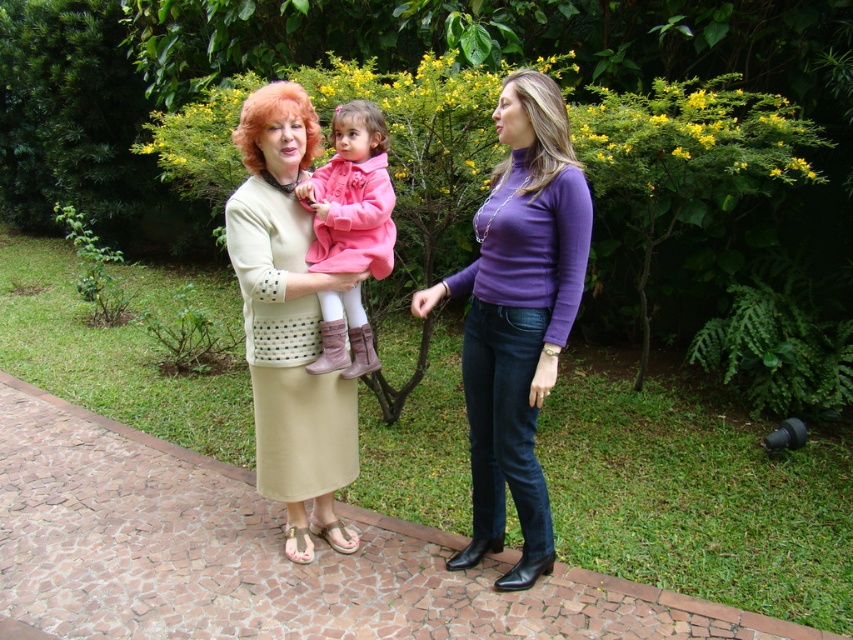
You are a photographer taking a picture of the purple turtleneck sweater at center and the smooth purple turtleneck at center. Which one should you focus on if you want to capture the larger item in the scene?

The purple turtleneck sweater at center is bigger than the smooth purple turtleneck at center, so you should focus on the purple turtleneck sweater at center to capture the larger item.

You are a tailor who needs to determine which item, the pink matte coat at center or the blonde synthetic wig at center, requires more fabric for alterations. Based on their sizes, which one would need more fabric?

The pink matte coat at center requires more fabric for alterations since it has a larger size compared to the blonde synthetic wig at center.